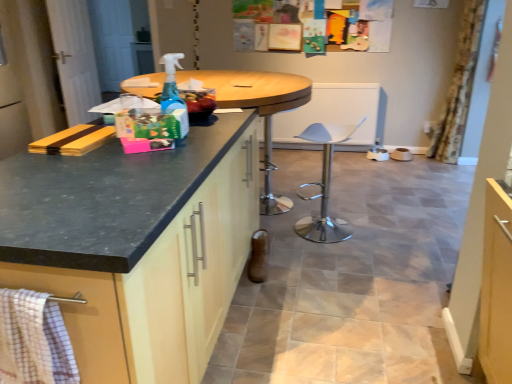
The height and width of the screenshot is (384, 512). I want to click on vacant space in front of white plastic swivel chair at center, so click(x=331, y=258).